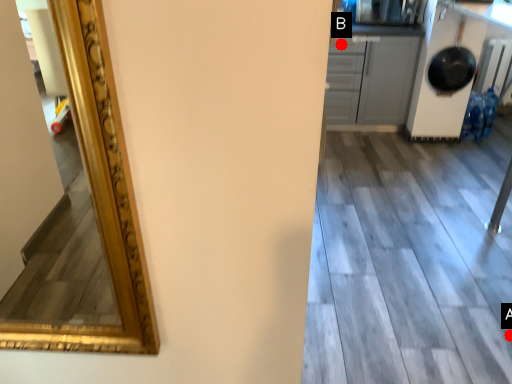
Question: Two points are circled on the image, labeled by A and B beside each circle. Among these points, which one is farthest from the camera?

Choices:
 (A) A is further
 (B) B is further

Answer: (B)